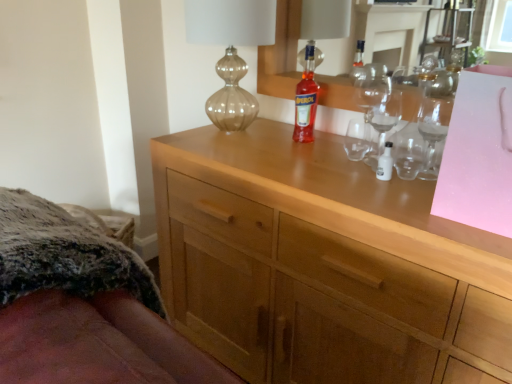
Identify the location of vacant area that is in front of translucent glass bottle at center. (315, 162).